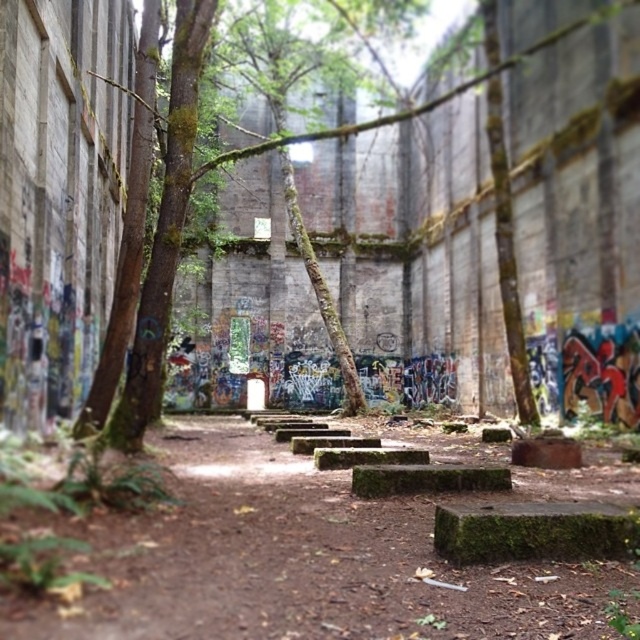
You are an urban explorer trying to navigate through the mossy concrete steps at center and the green mossy tree at center. Which object has a smaller width?

The mossy concrete steps at center is thinner than the green mossy tree at center, so the mossy concrete steps at center has a smaller width.

You are a photographer wanting to capture the green mossy tree at center and the mossy concrete steps at center in the same frame. Based on their positions, which object should you focus on first to ensure both are in the shot?

Since the mossy concrete steps at center are to the right of the green mossy tree at center, you should focus on the green mossy tree at center first to include both in the frame.